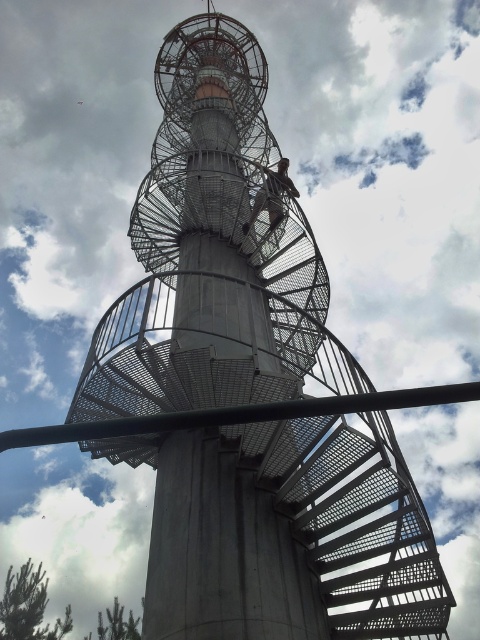
In the scene shown: You are standing at the base of the spiral staircase structure and want to reach the observation deck located at the top. According to the image, where is the concrete staircase at center located in relation to your current position?

The concrete staircase at center is located at point (x=240, y=413) in the image, which suggests it is positioned to your right and slightly forward from your current position at the base.

You are a maintenance worker needing to reach the top of the tower structure. You see the concrete staircase at center and the metallic climbing harness at center. Which object is located below the other?

The concrete staircase at center is positioned under the metallic climbing harness at center, so the staircase is below the harness.

You are a maintenance worker needing to reach the top of the structure. You see the concrete staircase at center and the metallic climbing harness at center. Which one is shorter in height and thus easier to climb over?

The concrete staircase at center has a lesser height compared to the metallic climbing harness at center, so it is shorter and easier to climb over.